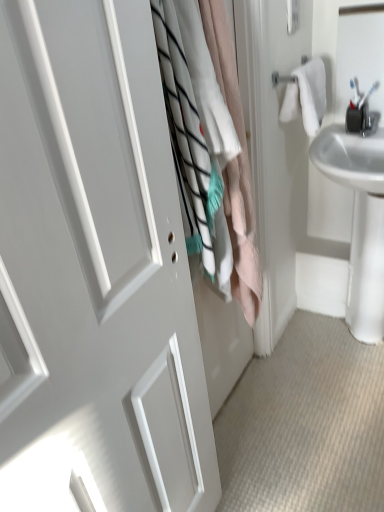
This screenshot has height=512, width=384. Describe the element at coordinates (96, 263) in the screenshot. I see `white matte door at center` at that location.

Measure the distance between point [207,434] and camera.

A distance of 1.18 meters exists between point [207,434] and camera.

Find the location of a particular element. The height and width of the screenshot is (512, 384). white glossy sink at right is located at coordinates (359, 221).

Locate an element on the screen. The height and width of the screenshot is (512, 384). white cotton bath towel at upper right is located at coordinates pyautogui.click(x=304, y=95).

How different are the orientations of white glossy sink at right and white matte door at center in degrees?

There is a 91.6-degree angle between the facing directions of white glossy sink at right and white matte door at center.

From the image's perspective, is white glossy sink at right over white matte door at center?

Yes, from the image's perspective, white glossy sink at right is above white matte door at center.

Consider the image. Between white glossy sink at right and white matte door at center, which one is positioned in front?

Positioned in front is white matte door at center.

Is white glossy sink at right thinner than white matte door at center?

No, white glossy sink at right is not thinner than white matte door at center.

From the picture: Is the surface of white cotton bath towel at upper right in direct contact with white matte door at center?

No, white cotton bath towel at upper right is not next to white matte door at center.

Between white cotton bath towel at upper right and white matte door at center, which one has more height?

white matte door at center.

Relative to white matte door at center, is white cotton bath towel at upper right in front or behind?

Visually, white cotton bath towel at upper right is located behind white matte door at center.

Is white matte door at center inside white cotton bath towel at upper right?

No.

What's the angular difference between white cotton bath towel at upper right and white cotton laundry at center's facing directions?

white cotton bath towel at upper right and white cotton laundry at center are facing 0.828 degrees away from each other.

From a real-world perspective, which is physically below, white cotton bath towel at upper right or white cotton laundry at center?

white cotton laundry at center is physically lower.

Consider the image. In terms of size, does white cotton bath towel at upper right appear bigger or smaller than white cotton laundry at center?

Considering their sizes, white cotton bath towel at upper right takes up less space than white cotton laundry at center.

Locate an element on the screen. Image resolution: width=384 pixels, height=512 pixels. laundry below the white cotton bath towel at upper right (from the image's perspective) is located at coordinates (210, 138).

In the image, is white cotton bath towel at upper right on the left side or the right side of white glossy sink at right?

Clearly, white cotton bath towel at upper right is on the left of white glossy sink at right in the image.

Is white cotton bath towel at upper right positioned behind white glossy sink at right?

Yes, white cotton bath towel at upper right is further from the camera.

In terms of size, does white cotton bath towel at upper right appear bigger or smaller than white glossy sink at right?

Considering their sizes, white cotton bath towel at upper right takes up less space than white glossy sink at right.

How different are the orientations of white matte door at center and white cotton bath towel at upper right in degrees?

The facing directions of white matte door at center and white cotton bath towel at upper right are 2.09 degrees apart.

Are white matte door at center and white cotton bath towel at upper right beside each other?

No, white matte door at center is not touching white cotton bath towel at upper right.

Would you say white matte door at center is inside or outside white cotton bath towel at upper right?

white matte door at center is outside white cotton bath towel at upper right.

Is white cotton laundry at center taller or shorter than white glossy sink at right?

white cotton laundry at center is taller than white glossy sink at right.

From the image's perspective, which object appears higher, white cotton laundry at center or white glossy sink at right?

white cotton laundry at center is shown above in the image.

Is white cotton laundry at center positioned behind white glossy sink at right?

No, the depth of white cotton laundry at center is less than that of white glossy sink at right.

From the image's perspective, which one is positioned higher, white matte door at center or white glossy sink at right?

white glossy sink at right, from the image's perspective.

How much distance is there between white matte door at center and white glossy sink at right?

They are 1.06 meters apart.

Locate an element on the screen. door located above the white glossy sink at right (from a real-world perspective) is located at coordinates (96, 263).

I want to click on door located on the left of white glossy sink at right, so [x=96, y=263].

Find the location of `bath towel that is on the right side of white matte door at center`. bath towel that is on the right side of white matte door at center is located at coordinates (304, 95).

From the picture: Considering their positions, is white matte door at center positioned closer to white cotton laundry at center than white glossy sink at right?

Based on the image, white matte door at center appears to be nearer to white cotton laundry at center.

Estimate the real-world distances between objects in this image. Which object is closer to white cotton bath towel at upper right, white cotton laundry at center or white glossy sink at right?

white glossy sink at right lies closer to white cotton bath towel at upper right than the other object.

Considering their positions, is white glossy sink at right positioned closer to white matte door at center than white cotton laundry at center?

white cotton laundry at center lies closer to white matte door at center than the other object.

Which object lies nearer to the anchor point white cotton bath towel at upper right, white cotton laundry at center or white matte door at center?

white cotton laundry at center is closer to white cotton bath towel at upper right.

From the picture: Which object lies nearer to the anchor point white matte door at center, white glossy sink at right or white cotton bath towel at upper right?

The object closer to white matte door at center is white cotton bath towel at upper right.

Considering their positions, is white matte door at center positioned further to white glossy sink at right than white cotton laundry at center?

The object further to white glossy sink at right is white matte door at center.

Considering their positions, is white cotton laundry at center positioned further to white glossy sink at right than white cotton bath towel at upper right?

Among the two, white cotton laundry at center is located further to white glossy sink at right.

From the image, which object appears to be nearer to white matte door at center, white cotton bath towel at upper right or white glossy sink at right?

Among the two, white cotton bath towel at upper right is located nearer to white matte door at center.

Locate an element on the screen. The image size is (384, 512). laundry between white matte door at center and white glossy sink at right from front to back is located at coordinates (210, 138).

I want to click on laundry located between white matte door at center and white cotton bath towel at upper right in the depth direction, so click(x=210, y=138).

Locate an element on the screen. Image resolution: width=384 pixels, height=512 pixels. bath towel between white cotton laundry at center and white glossy sink at right is located at coordinates (304, 95).

Where is `sink between white matte door at center and white cotton bath towel at upper right in the front-back direction`? sink between white matte door at center and white cotton bath towel at upper right in the front-back direction is located at coordinates (359, 221).